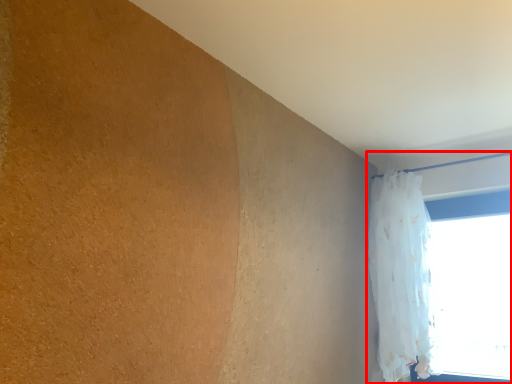
Question: In this image, where is window (annotated by the red box) located relative to curtain?

Choices:
 (A) left
 (B) right

Answer: (B)